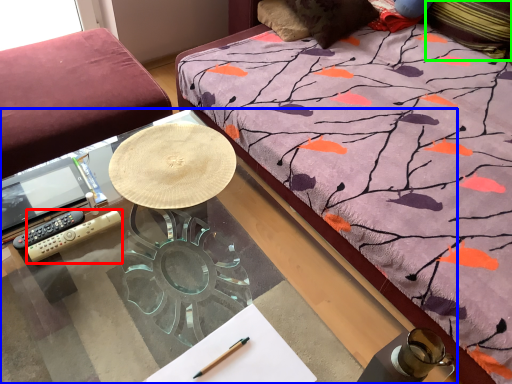
Question: Which is farther away from remote control (highlighted by a red box)? desk (highlighted by a blue box) or pillow (highlighted by a green box)?

Choices:
 (A) desk
 (B) pillow

Answer: (B)